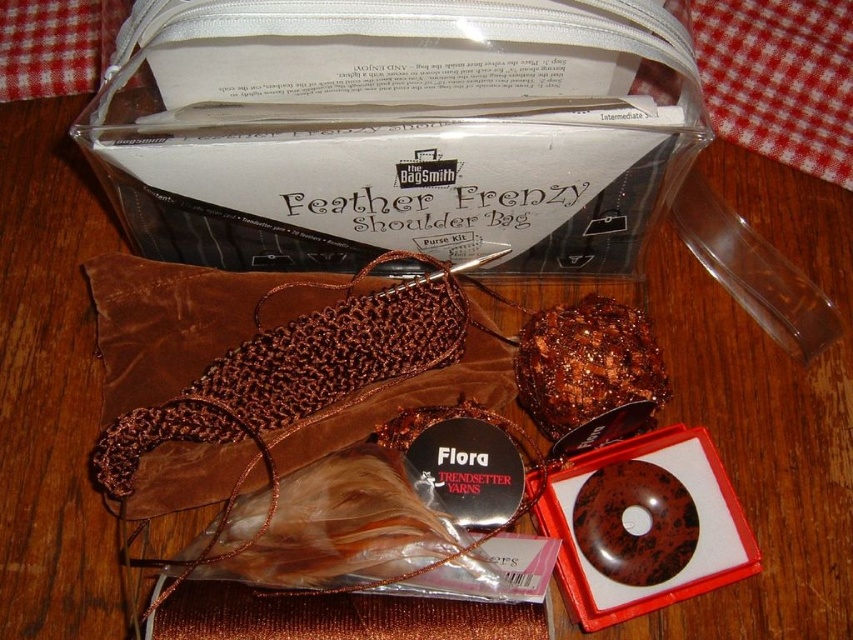
What is located at the coordinates point (395, 131) in the image?

The coordinates point (395, 131) correspond to the matte brown yarn at upper center.

Based on the photo, you are a baker who wants to place the shiny brown chocolate cake at center on a shelf. The shelf can only hold items up to the width of the matte brown yarn at upper center. Can the chocolate cake fit on the shelf?

The shiny brown chocolate cake at center is smaller in width than the matte brown yarn at upper center, so it can fit on the shelf since the shelf can hold items up to the yarn width.